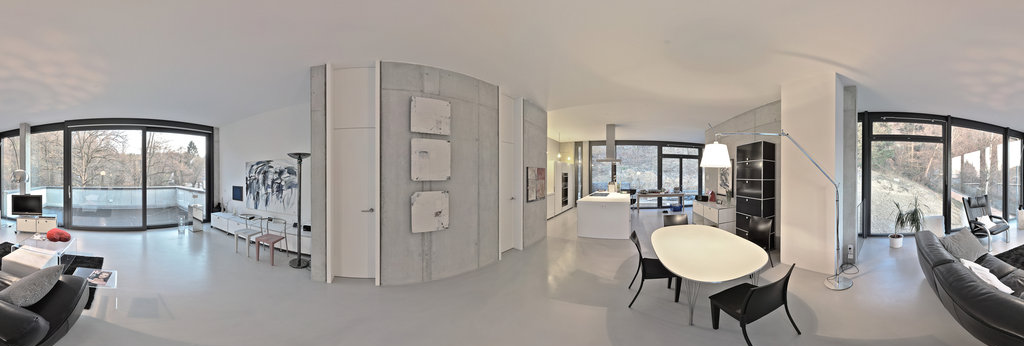
At what (x,y) coordinates should I click in order to perform the action: click on shelf. Please return your answer as a coordinate pair (x, y). The image size is (1024, 346). Looking at the image, I should click on (757, 172).